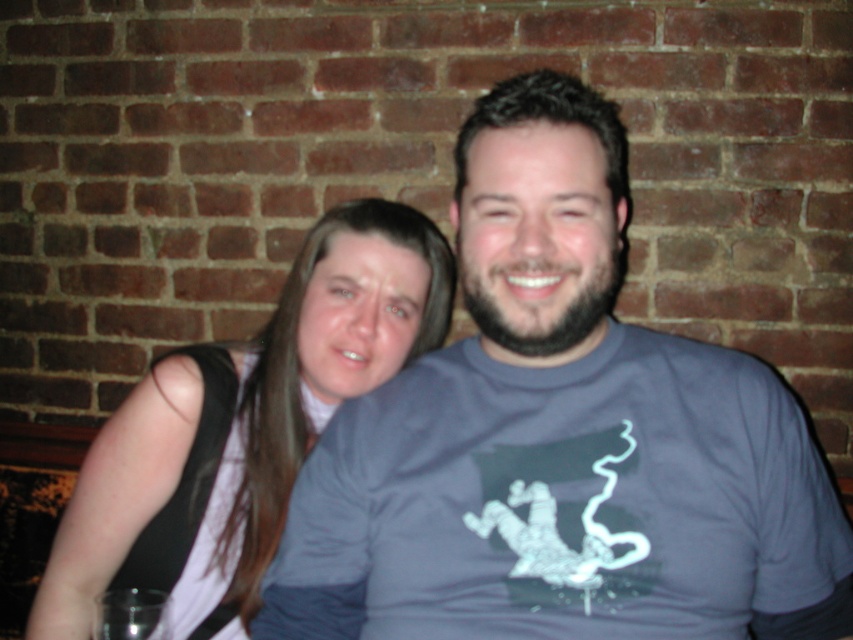
Can you confirm if gray matte t-shirt at center is taller than white matte shirt at center?

Yes, gray matte t-shirt at center is taller than white matte shirt at center.

Looking at this image, between gray matte t-shirt at center and white matte shirt at center, which one is positioned higher?

gray matte t-shirt at center is higher up.

Is point (550, 376) behind point (407, 216)?

No, it is in front of (407, 216).

This screenshot has width=853, height=640. In order to click on gray matte t-shirt at center in this screenshot , I will do `click(560, 440)`.